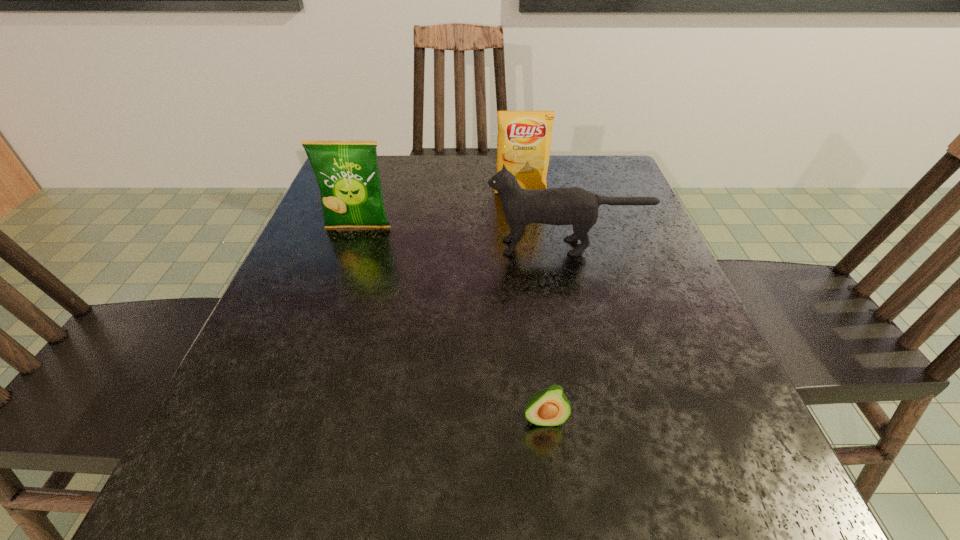
The image size is (960, 540). Identify the location of vacant space located 0.080m on the front-facing side of the second nearest object. (447, 247).

You are a GUI agent. You are given a task and a screenshot of the screen. Output one action in this format:
    pyautogui.click(x=<x>, y=<y>)
    Task: Click on the free location located on the front-facing side of the second nearest object
    Image resolution: width=960 pixels, height=540 pixels.
    Given the screenshot: What is the action you would take?
    pyautogui.click(x=341, y=247)

The height and width of the screenshot is (540, 960). I want to click on free region located on the cut side of the shortest object, so click(551, 476).

Where is `object that is at the far edge`? This screenshot has width=960, height=540. object that is at the far edge is located at coordinates (524, 139).

This screenshot has width=960, height=540. What are the coordinates of `object present at the left edge` in the screenshot? It's located at (347, 173).

Where is `object that is at the right edge`? The image size is (960, 540). object that is at the right edge is located at coordinates (575, 206).

This screenshot has width=960, height=540. I want to click on vacant space at the near edge of the desktop, so click(603, 477).

Locate an element on the screen. vacant space at the left edge of the desktop is located at coordinates (347, 322).

You are a GUI agent. You are given a task and a screenshot of the screen. Output one action in this format:
    pyautogui.click(x=<x>, y=<y>)
    Task: Click on the vacant region at the right edge of the desktop
    The image size is (960, 540).
    Given the screenshot: What is the action you would take?
    pyautogui.click(x=703, y=352)

In the image, there is a desktop. At what (x,y) coordinates should I click in order to perform the action: click on free space at the near left corner. Please return your answer as a coordinate pair (x, y). The image size is (960, 540). Looking at the image, I should click on (267, 498).